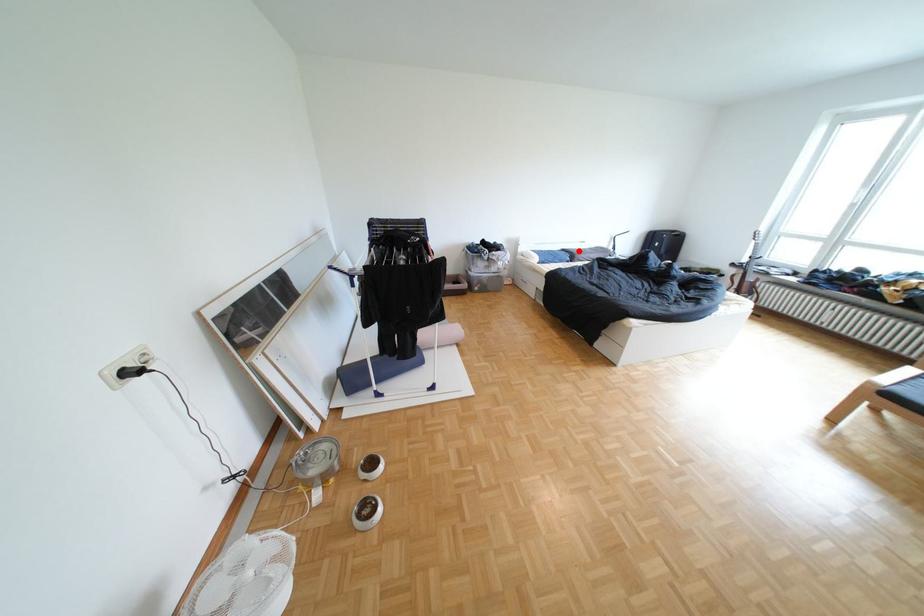
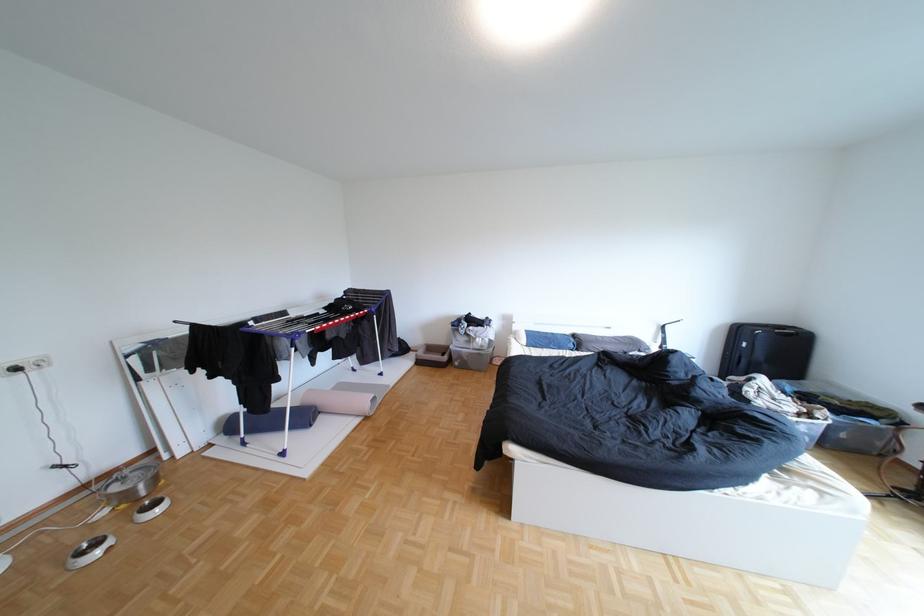
Question: I am providing you with two images of the same scene from different viewpoints. In image1, a red point is highlighted. Considering the same 3D point in image2, which of the following is correct?

Choices:
 (A) It is closer
 (B) It is farther

Answer: (B)